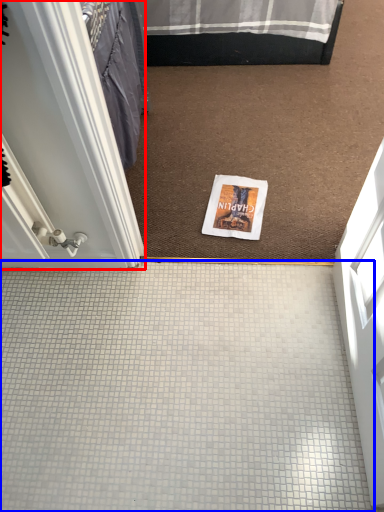
Question: Which object appears farthest to the camera in this image, door (highlighted by a red box) or plain (highlighted by a blue box)?

Choices:
 (A) door
 (B) plain

Answer: (B)